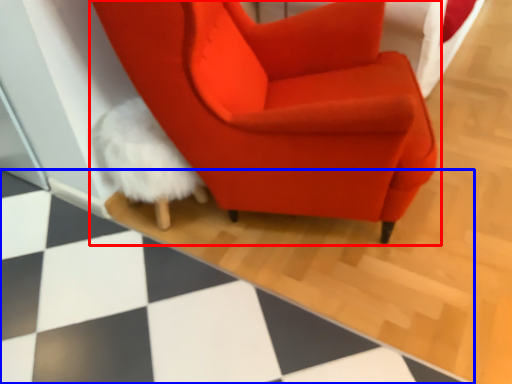
Question: Which point is further to the camera, chair (highlighted by a red box) or tile (highlighted by a blue box)?

Choices:
 (A) chair
 (B) tile

Answer: (A)